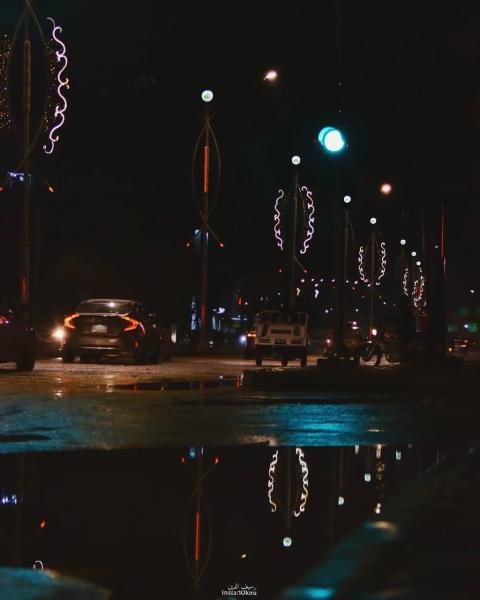
I want to click on light, so click(333, 141).